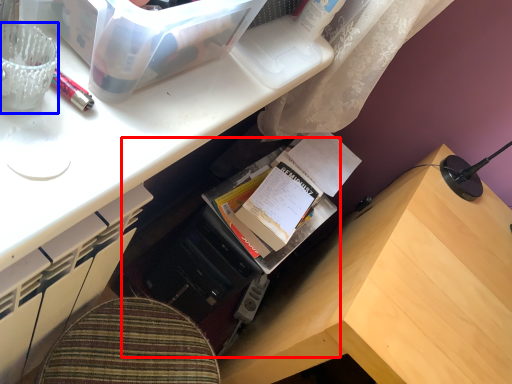
Question: Which point is closer to the camera, bookshelf (highlighted by a red box) or stationery (highlighted by a blue box)?

Choices:
 (A) bookshelf
 (B) stationery

Answer: (B)